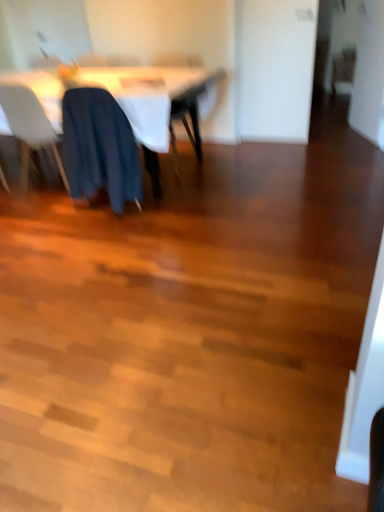
Locate an element on the screen. Image resolution: width=384 pixels, height=512 pixels. vacant area that lies to the right of dark blue fabric at center, the fourth chair viewed from the back is located at coordinates (160, 212).